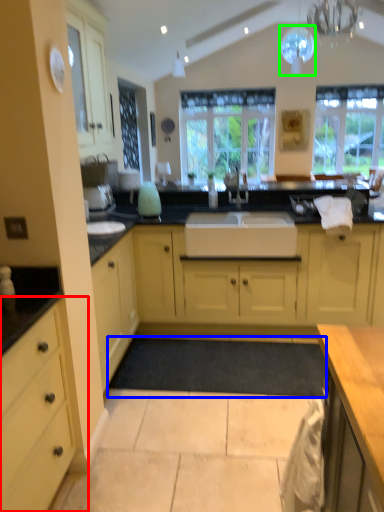
Question: Based on their relative distances, which object is nearer to cabinetry (highlighted by a red box)? Choose from plain (highlighted by a blue box) and light fixture (highlighted by a green box).

Choices:
 (A) plain
 (B) light fixture

Answer: (A)